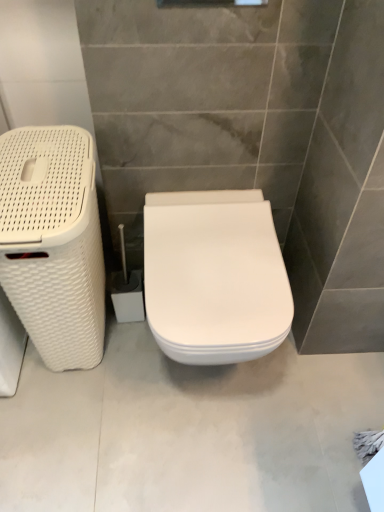
The height and width of the screenshot is (512, 384). In order to click on vacant space situated above white woven laundry basket at left (from a real-world perspective) in this screenshot , I will do `click(41, 166)`.